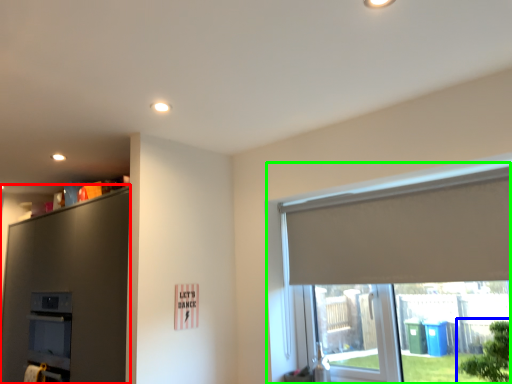
Question: Considering the real-world distances, which object is closest to dresser (highlighted by a red box)? tree (highlighted by a blue box) or window (highlighted by a green box).

Choices:
 (A) tree
 (B) window

Answer: (B)